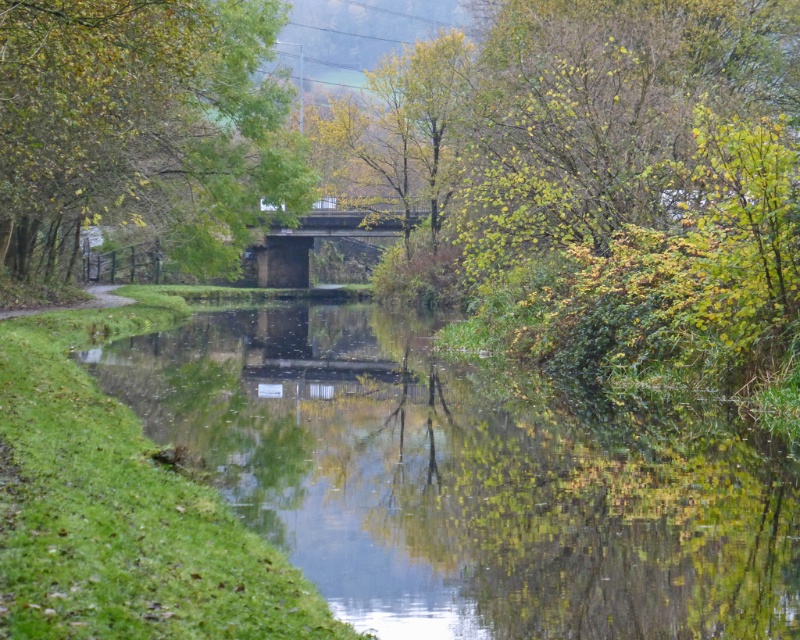
Question: Among these points, which one is farthest from the camera?

Choices:
 (A) (272, 234)
 (B) (20, 260)

Answer: (A)

Question: Which point is farther to the camera?

Choices:
 (A) (270, 19)
 (B) (798, 588)
 (C) (276, 273)

Answer: (C)

Question: In this image, where is clear water at center located relative to concrete bridge at center?

Choices:
 (A) right
 (B) left

Answer: (A)

Question: Where is clear water at center located in relation to green leafy tree at center in the image?

Choices:
 (A) above
 (B) below

Answer: (B)

Question: Which object is the farthest from the green leafy tree at center?

Choices:
 (A) concrete bridge at center
 (B) clear water at center

Answer: (A)

Question: From the image, what is the correct spatial relationship of clear water at center in relation to concrete bridge at center?

Choices:
 (A) below
 (B) above

Answer: (A)